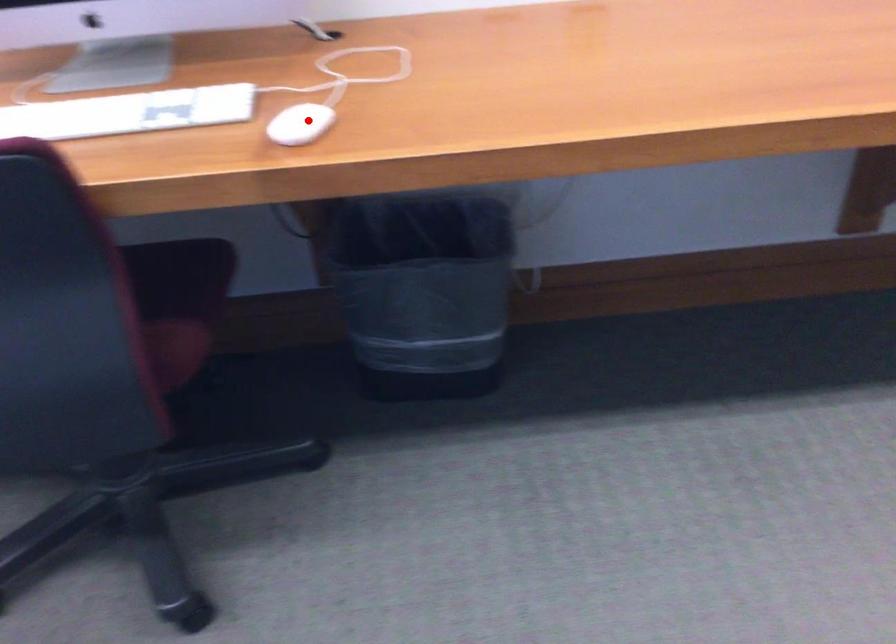
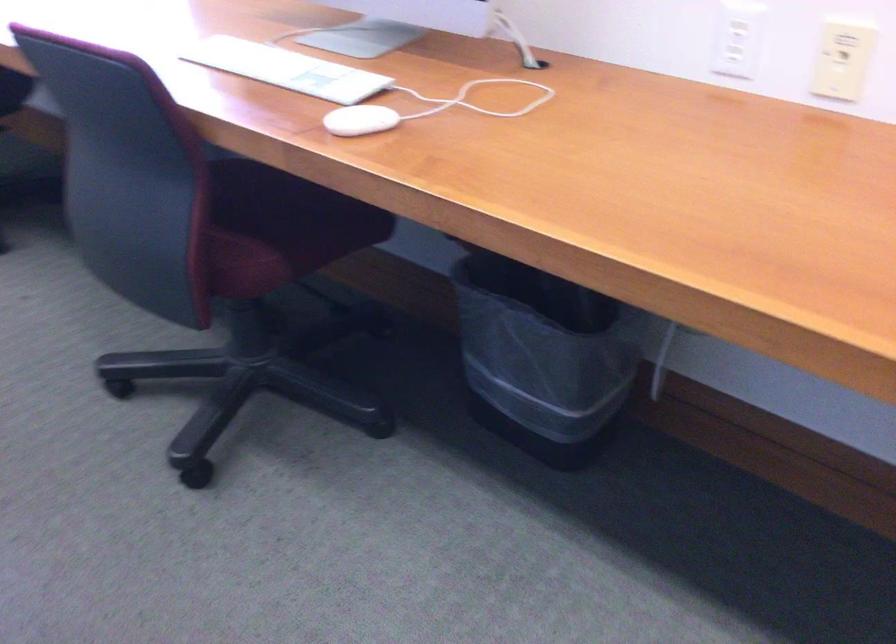
Locate, in the second image, the point that corresponds to the highlighted location in the first image.

(359, 120)